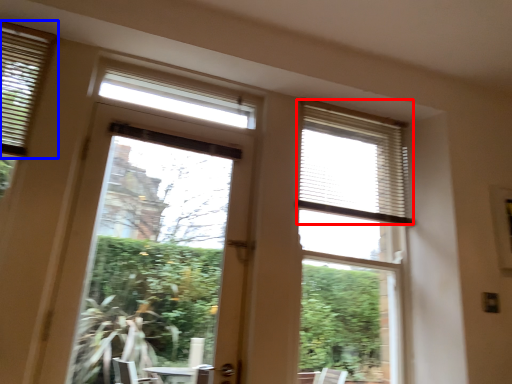
Question: Which point is further to the camera, blind (highlighted by a red box) or window blind (highlighted by a blue box)?

Choices:
 (A) blind
 (B) window blind

Answer: (A)